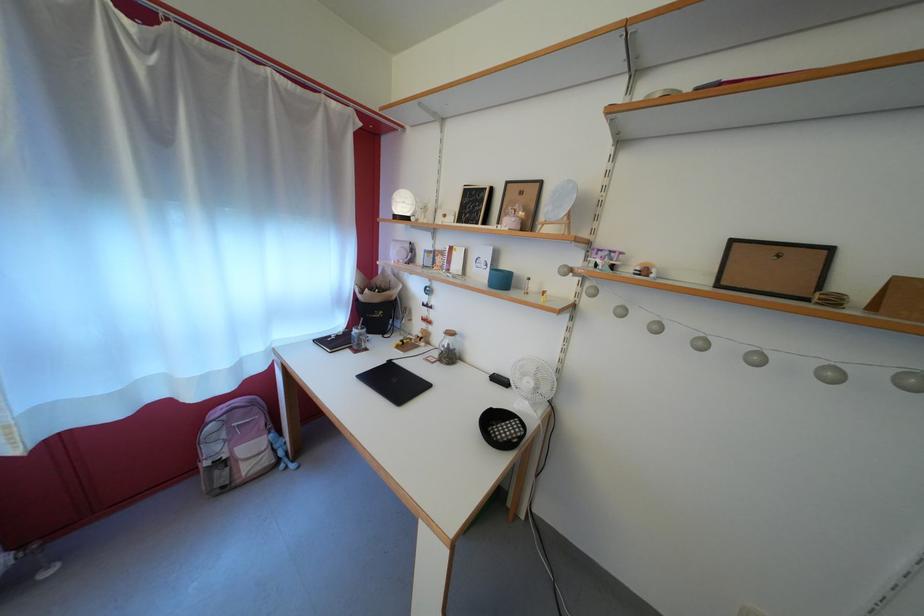
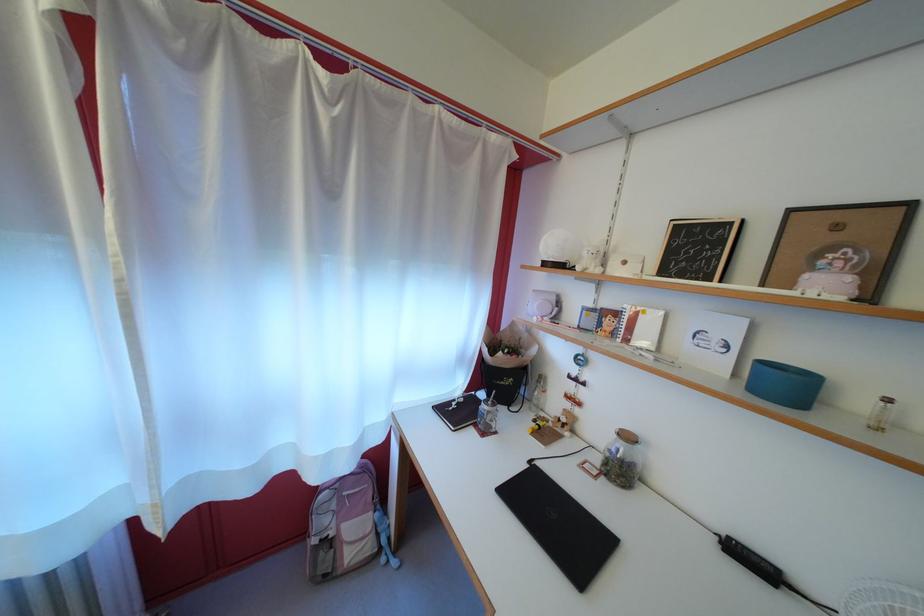
Where in the second image is the point corresponding to point 459,339 from the first image?

(637, 444)